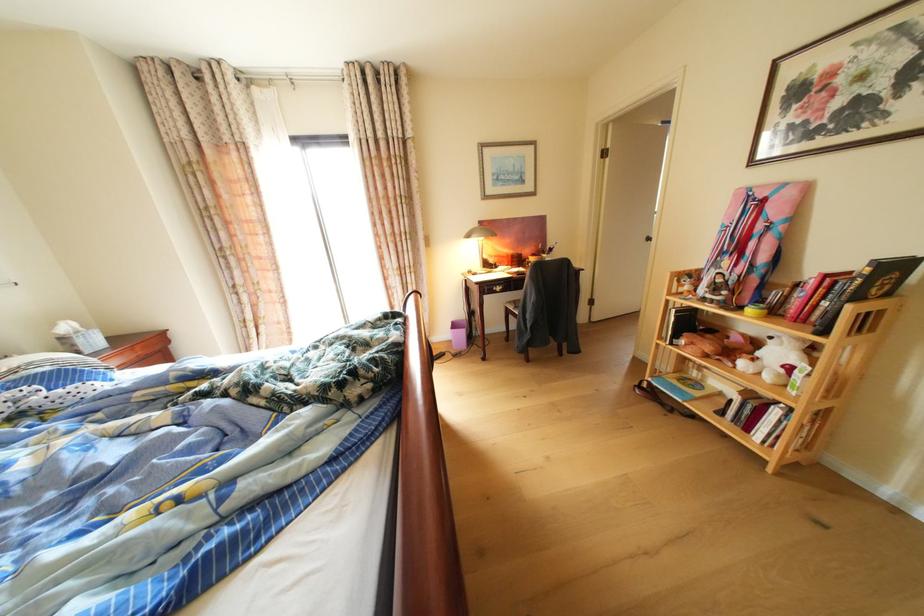
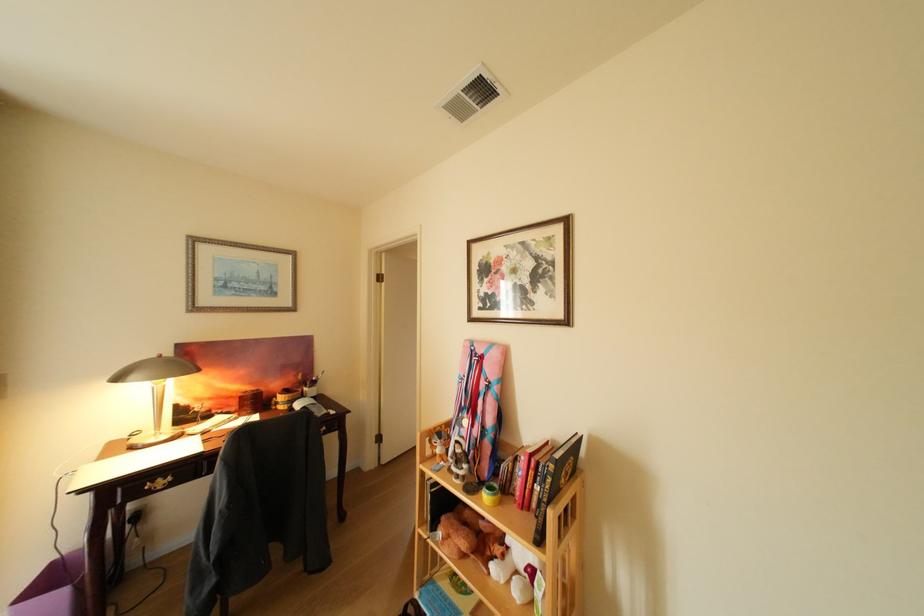
Question: I am providing you with two images of the same scene from different viewpoints. After the viewpoint changes to image2, which objects are now occluded?

Choices:
 (A) small yellow cup
 (B) black book
 (C) brass drawer handle
 (D) none of these

Answer: (D)